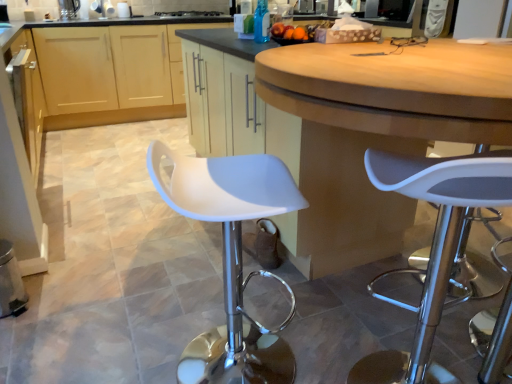
Locate an element on the screen. This screenshot has height=384, width=512. free space behind white plastic stool at center is located at coordinates (233, 298).